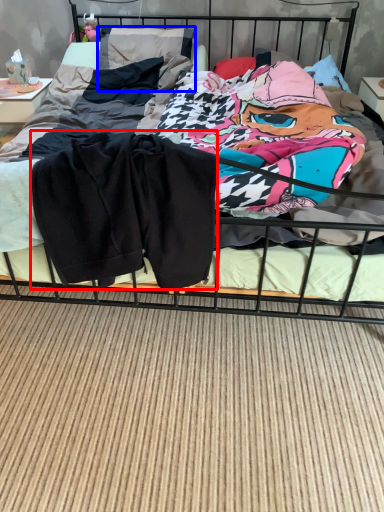
Question: Which object is closer to the camera taking this photo, baby clothe (highlighted by a red box) or pillow (highlighted by a blue box)?

Choices:
 (A) baby clothe
 (B) pillow

Answer: (A)